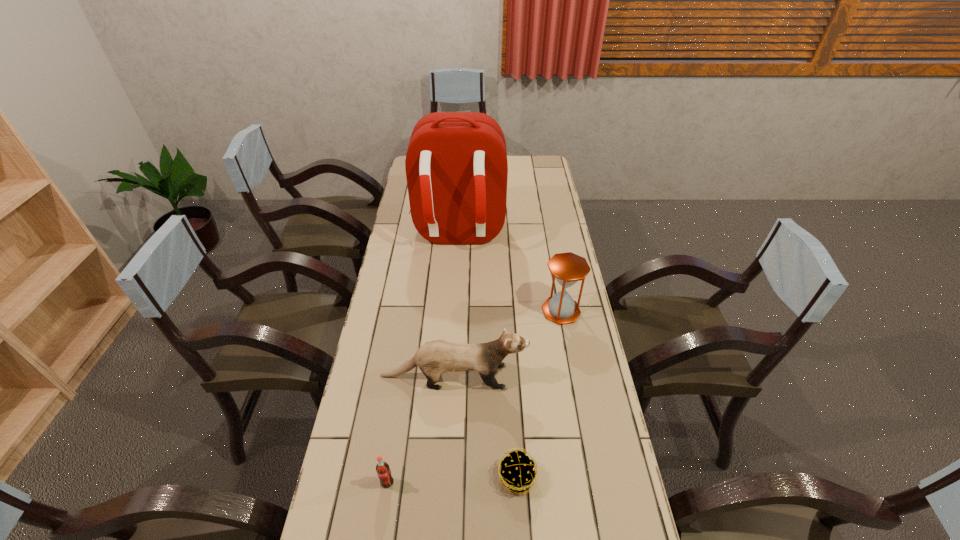
Identify the location of vacant region between the rightmost object and the shortest object. This screenshot has height=540, width=960. (539, 394).

Find the location of a particular element. The width and height of the screenshot is (960, 540). free space between the farthest object and the third farthest object is located at coordinates (455, 306).

At what (x,y) coordinates should I click in order to perform the action: click on blank region between the second shortest object and the shortest object. Please return your answer as a coordinate pair (x, y). The image size is (960, 540). Looking at the image, I should click on (452, 480).

The image size is (960, 540). I want to click on vacant area that lies between the hourglass and the farthest object, so click(x=509, y=273).

I want to click on vacant area that lies between the rightmost object and the second shortest object, so click(x=474, y=397).

What are the coordinates of `vacant area between the rightmost object and the tallest object` in the screenshot? It's located at (509, 273).

You are a GUI agent. You are given a task and a screenshot of the screen. Output one action in this format:
    pyautogui.click(x=<x>, y=<y>)
    Task: Click on the object that can be found as the fourth closest to the second shortest object
    
    Given the screenshot: What is the action you would take?
    pyautogui.click(x=456, y=165)

This screenshot has width=960, height=540. Find the location of `the second closest object to the soda bottle`. the second closest object to the soda bottle is located at coordinates (517, 473).

Locate an element on the screen. free space that satisfies the following two spatial constraints: 1. on the strap side of the patty; 2. on the right side of the backpack is located at coordinates (444, 477).

The height and width of the screenshot is (540, 960). Find the location of `free location that satisfies the following two spatial constraints: 1. on the face of the third nearest object; 2. on the label of the fourth tallest object`. free location that satisfies the following two spatial constraints: 1. on the face of the third nearest object; 2. on the label of the fourth tallest object is located at coordinates (447, 483).